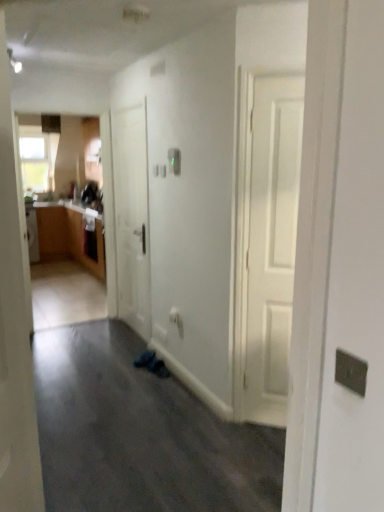
Question: Is white matte door at center, acting as the 1th door starting from the back, shorter than clear glass window at upper left?

Choices:
 (A) yes
 (B) no

Answer: (B)

Question: Is white matte door at center, the 2th door in the front-to-back sequence, not close to clear glass window at upper left?

Choices:
 (A) no
 (B) yes

Answer: (B)

Question: Could you tell me if white matte door at center, the 2th door in the front-to-back sequence, is facing clear glass window at upper left?

Choices:
 (A) yes
 (B) no

Answer: (B)

Question: From the image's perspective, would you say white matte door at center, acting as the 1th door starting from the back, is positioned over clear glass window at upper left?

Choices:
 (A) yes
 (B) no

Answer: (B)

Question: Can you confirm if white matte door at center, the 2th door in the front-to-back sequence, is positioned to the left of clear glass window at upper left?

Choices:
 (A) no
 (B) yes

Answer: (A)

Question: Are white matte door at center, the 2th door in the front-to-back sequence, and clear glass window at upper left beside each other?

Choices:
 (A) yes
 (B) no

Answer: (B)

Question: Considering the relative positions of clear glass window at upper left and white matte door at left, which appears as the second door when viewed from the left, in the image provided, is clear glass window at upper left to the left of white matte door at left, which appears as the second door when viewed from the left, from the viewer's perspective?

Choices:
 (A) no
 (B) yes

Answer: (B)

Question: Is clear glass window at upper left not inside white matte door at left, which is counted as the first door, starting from the right?

Choices:
 (A) no
 (B) yes

Answer: (B)

Question: Is clear glass window at upper left looking in the opposite direction of white matte door at left, which is counted as the first door, starting from the right?

Choices:
 (A) yes
 (B) no

Answer: (B)

Question: From the image's perspective, is clear glass window at upper left located beneath white matte door at left, which appears as the second door when viewed from the left?

Choices:
 (A) no
 (B) yes

Answer: (A)

Question: From a real-world perspective, is clear glass window at upper left on top of white matte door at left, which is the first door from front to back?

Choices:
 (A) yes
 (B) no

Answer: (A)

Question: Considering the relative sizes of clear glass window at upper left and white matte door at left, which is counted as the first door, starting from the right, in the image provided, is clear glass window at upper left shorter than white matte door at left, which is counted as the first door, starting from the right,?

Choices:
 (A) no
 (B) yes

Answer: (B)

Question: Is clear glass window at upper left at the back of white matte door at left, the 2th door from the back?

Choices:
 (A) no
 (B) yes

Answer: (A)